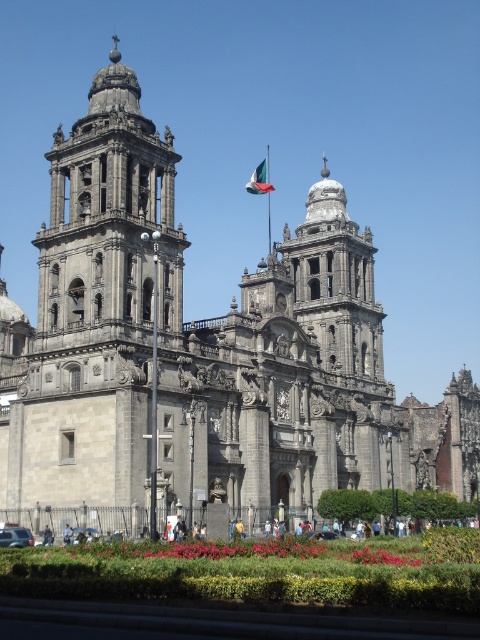
Is point (94, 76) positioned behind point (251, 186)?

Yes, it is.

Can you confirm if gray stone tower at upper left is positioned above green fabric flag at center?

Indeed, gray stone tower at upper left is positioned over green fabric flag at center.

The image size is (480, 640). What do you see at coordinates (108, 221) in the screenshot? I see `gray stone tower at upper left` at bounding box center [108, 221].

Find the location of a particular element. The width and height of the screenshot is (480, 640). gray stone tower at upper left is located at coordinates (108, 221).